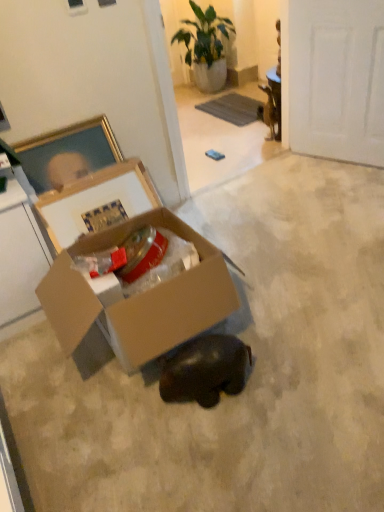
Question: Does cardboard box at center come in front of green leafy plant at upper center?

Choices:
 (A) no
 (B) yes

Answer: (B)

Question: Does cardboard box at center appear on the right side of green leafy plant at upper center?

Choices:
 (A) yes
 (B) no

Answer: (B)

Question: Is cardboard box at center aimed at green leafy plant at upper center?

Choices:
 (A) no
 (B) yes

Answer: (A)

Question: Can green leafy plant at upper center be found inside cardboard box at center?

Choices:
 (A) no
 (B) yes

Answer: (A)

Question: From a real-world perspective, is cardboard box at center on top of green leafy plant at upper center?

Choices:
 (A) no
 (B) yes

Answer: (A)

Question: Relative to white matte door at upper right, is cardboard box at center in front or behind?

Choices:
 (A) behind
 (B) front

Answer: (B)

Question: Considering the positions of cardboard box at center and white matte door at upper right in the image, is cardboard box at center taller or shorter than white matte door at upper right?

Choices:
 (A) short
 (B) tall

Answer: (A)

Question: Is cardboard box at center inside or outside of white matte door at upper right?

Choices:
 (A) inside
 (B) outside

Answer: (B)

Question: From a real-world perspective, is cardboard box at center above or below white matte door at upper right?

Choices:
 (A) below
 (B) above

Answer: (A)

Question: Considering the positions of shiny black elephant at center and white matte door at upper right in the image, is shiny black elephant at center wider or thinner than white matte door at upper right?

Choices:
 (A) thin
 (B) wide

Answer: (B)

Question: In the image, is shiny black elephant at center positioned in front of or behind white matte door at upper right?

Choices:
 (A) front
 (B) behind

Answer: (A)

Question: From the image's perspective, is shiny black elephant at center above or below white matte door at upper right?

Choices:
 (A) below
 (B) above

Answer: (A)

Question: Based on their sizes in the image, would you say shiny black elephant at center is bigger or smaller than white matte door at upper right?

Choices:
 (A) big
 (B) small

Answer: (B)

Question: From the image's perspective, is cardboard box at center located above or below green leafy plant at upper center?

Choices:
 (A) below
 (B) above

Answer: (A)

Question: In terms of height, does cardboard box at center look taller or shorter compared to green leafy plant at upper center?

Choices:
 (A) short
 (B) tall

Answer: (A)